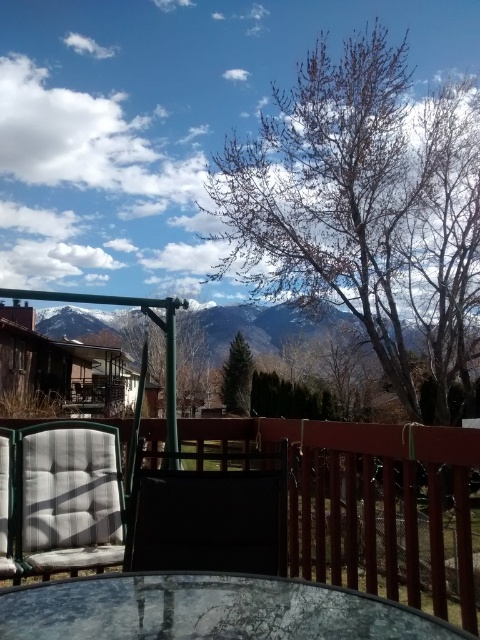
Can you confirm if green metal swing at center is thinner than gray fabric cushion at left?

No, green metal swing at center is not thinner than gray fabric cushion at left.

What do you see at coordinates (147, 512) in the screenshot? The image size is (480, 640). I see `green metal swing at center` at bounding box center [147, 512].

Image resolution: width=480 pixels, height=640 pixels. I want to click on green metal swing at center, so click(147, 512).

Is transparent glass table at center in front of gray fabric cushion at left?

Yes, transparent glass table at center is in front of gray fabric cushion at left.

Which is more to the right, transparent glass table at center or gray fabric cushion at left?

Positioned to the right is transparent glass table at center.

Is point (308, 605) positioned behind point (41, 452)?

No, (308, 605) is closer to viewer.

Locate an element on the screen. Image resolution: width=480 pixels, height=640 pixels. transparent glass table at center is located at coordinates (207, 611).

Consider the image. Who is higher up, transparent glass table at center or matte gray cushion at lower left?

Positioned higher is transparent glass table at center.

Between point (26, 624) and point (3, 568), which one is positioned behind?

The point (3, 568) is more distant.

This screenshot has height=640, width=480. Find the location of `transparent glass table at center`. transparent glass table at center is located at coordinates (207, 611).